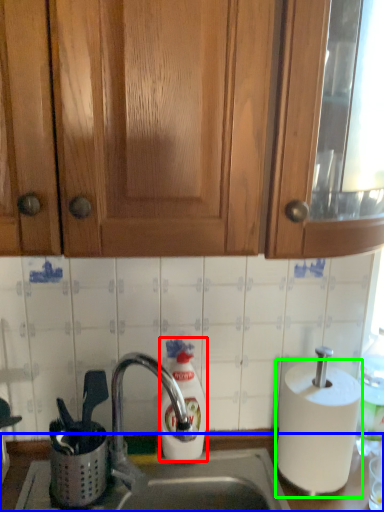
Question: Which object is the closest to the soap dispenser (highlighted by a red box)? Choose among these: counter (highlighted by a blue box) or paper towel (highlighted by a green box).

Choices:
 (A) counter
 (B) paper towel

Answer: (A)